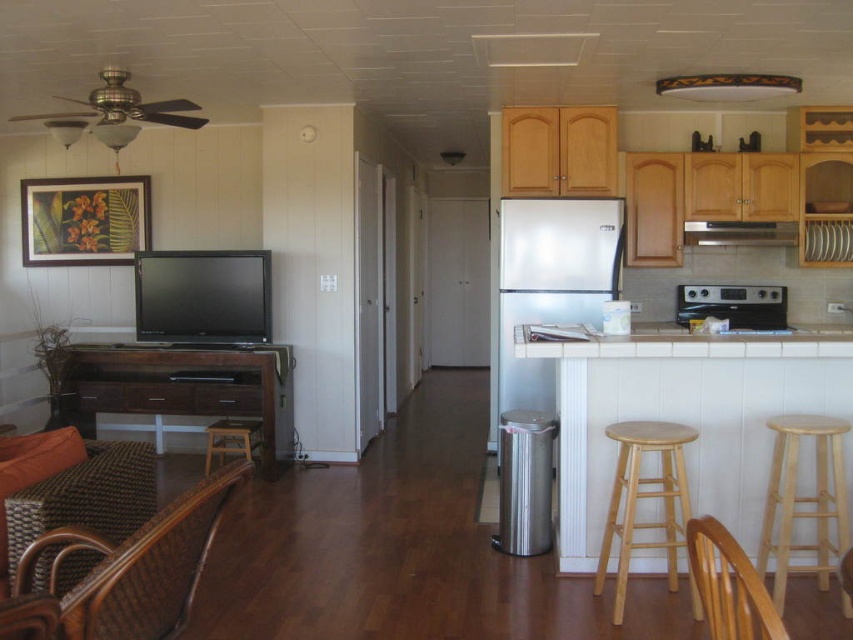
Is woven brown chair at lower left shorter than brown wooden chair at lower right?

Correct, woven brown chair at lower left is not as tall as brown wooden chair at lower right.

Does point (152, 492) lie in front of point (735, 612)?

No.

Is point (137, 461) more distant than point (689, 563)?

That is False.

Locate an element on the screen. This screenshot has width=853, height=640. woven brown chair at lower left is located at coordinates pyautogui.click(x=85, y=497).

Is woven rattan chair at lower left wider than light brown wooden stool at lower right?

Indeed, woven rattan chair at lower left has a greater width compared to light brown wooden stool at lower right.

Is point (183, 500) farther from camera compared to point (663, 442)?

That is False.

At what (x,y) coordinates should I click in order to perform the action: click on woven rattan chair at lower left. Please return your answer as a coordinate pair (x, y). This screenshot has height=640, width=853. Looking at the image, I should click on (140, 566).

At what (x,y) coordinates should I click in order to perform the action: click on woven rattan chair at lower left. Please return your answer as a coordinate pair (x, y). The width and height of the screenshot is (853, 640). Looking at the image, I should click on (140, 566).

Can you confirm if woven rattan chair at lower left is thinner than stainless steel oven at right?

Yes.

Who is more forward, (x=148, y=609) or (x=718, y=305)?

Point (x=148, y=609) is in front.

You are a GUI agent. You are given a task and a screenshot of the screen. Output one action in this format:
    pyautogui.click(x=<x>, y=<y>)
    Task: Click on the woven rattan chair at lower left
    
    Given the screenshot: What is the action you would take?
    pyautogui.click(x=140, y=566)